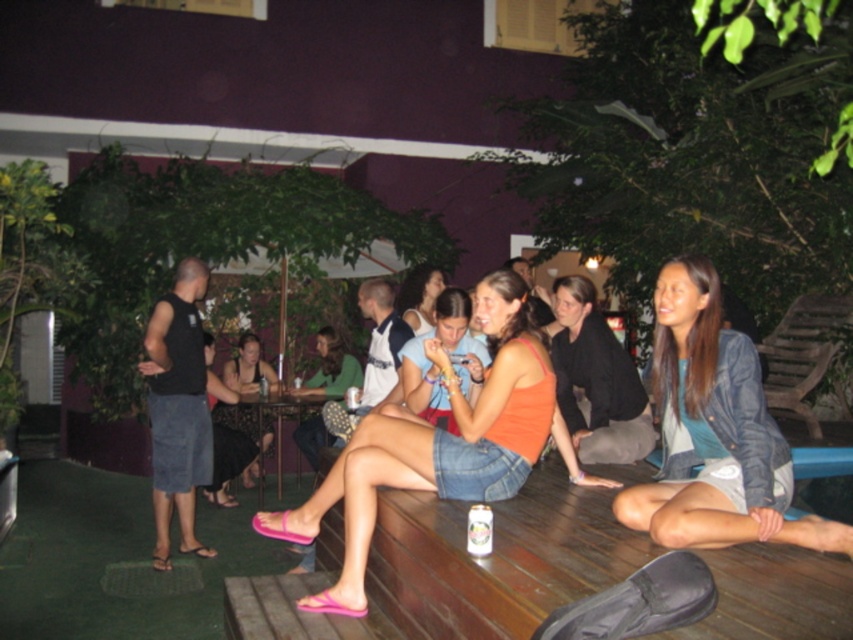
Question: Among these points, which one is nearest to the camera?

Choices:
 (A) (419, 300)
 (B) (520, 536)

Answer: (B)

Question: Is wooden at center above matte orange tank top at center?

Choices:
 (A) no
 (B) yes

Answer: (A)

Question: Which object appears farthest from the camera in this image?

Choices:
 (A) white paper can at lower center
 (B) wooden at center
 (C) denim jacket at lower right

Answer: (A)

Question: Which of the following is the closest to the observer?

Choices:
 (A) metallic can at center
 (B) wooden at center
 (C) black satin dress at center
 (D) orange tank top at center

Answer: (B)

Question: Where is black satin dress at center located in relation to metallic can at center in the image?

Choices:
 (A) left
 (B) right

Answer: (A)

Question: Is orange matte tank top at center to the left of metallic can at center from the viewer's perspective?

Choices:
 (A) yes
 (B) no

Answer: (B)